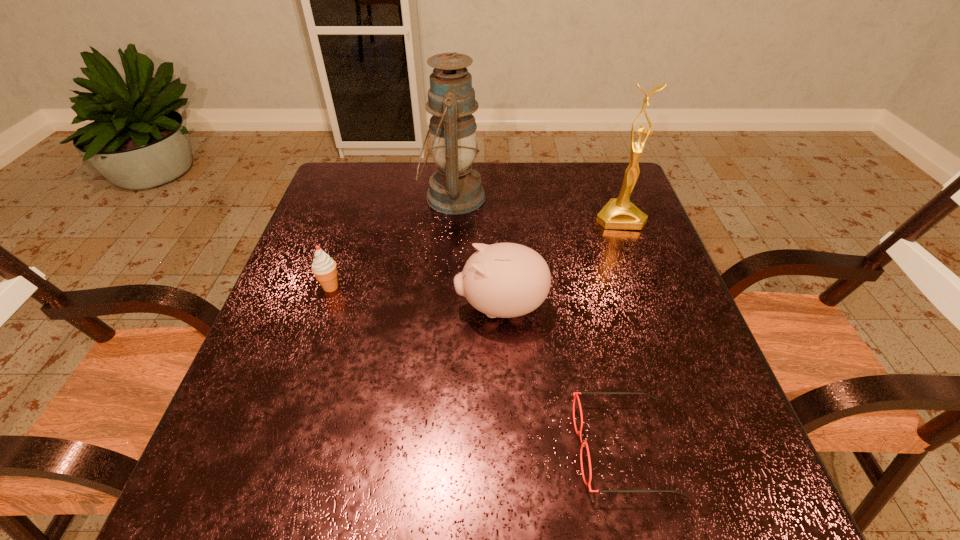
In order to click on oil lamp in this screenshot , I will do `click(454, 189)`.

This screenshot has width=960, height=540. I want to click on award, so click(x=619, y=213).

Where is `the third shortest object`? the third shortest object is located at coordinates (505, 280).

Where is `the second shortest object`? This screenshot has height=540, width=960. the second shortest object is located at coordinates (324, 268).

At what (x,y) coordinates should I click in order to perform the action: click on icecream. Please return your answer as a coordinate pair (x, y). Image resolution: width=960 pixels, height=540 pixels. Looking at the image, I should click on (324, 268).

Find the location of a particular element. This screenshot has height=540, width=960. the nearest object is located at coordinates coord(575,394).

Where is `spectacles`? Image resolution: width=960 pixels, height=540 pixels. spectacles is located at coordinates (575, 394).

Locate an element on the screen. vacant space located on the right of the oil lamp is located at coordinates (617, 197).

Image resolution: width=960 pixels, height=540 pixels. What are the coordinates of `vacant space situated on the front-facing side of the award` in the screenshot? It's located at (636, 262).

Where is `vacant space located at the snout of the piggy bank`? The width and height of the screenshot is (960, 540). vacant space located at the snout of the piggy bank is located at coordinates (278, 307).